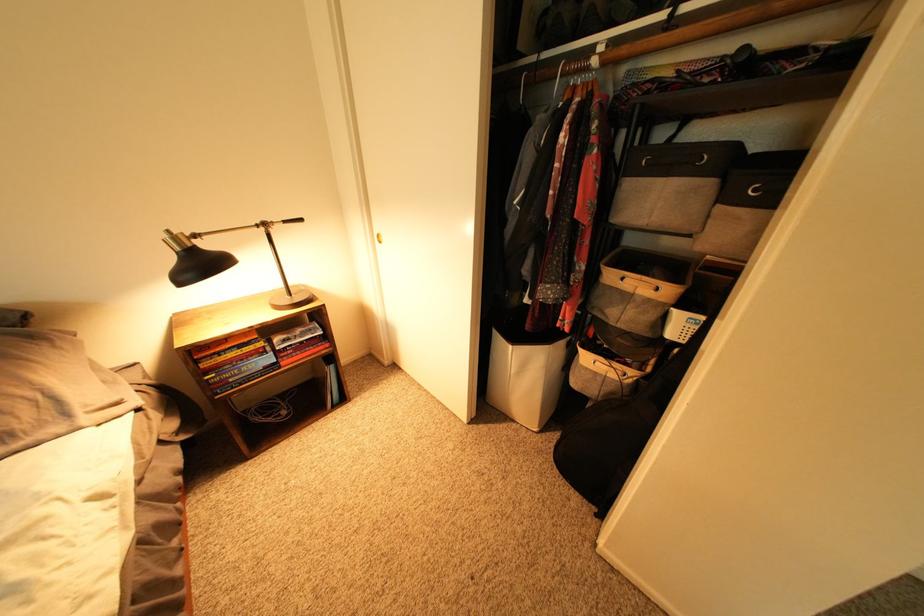
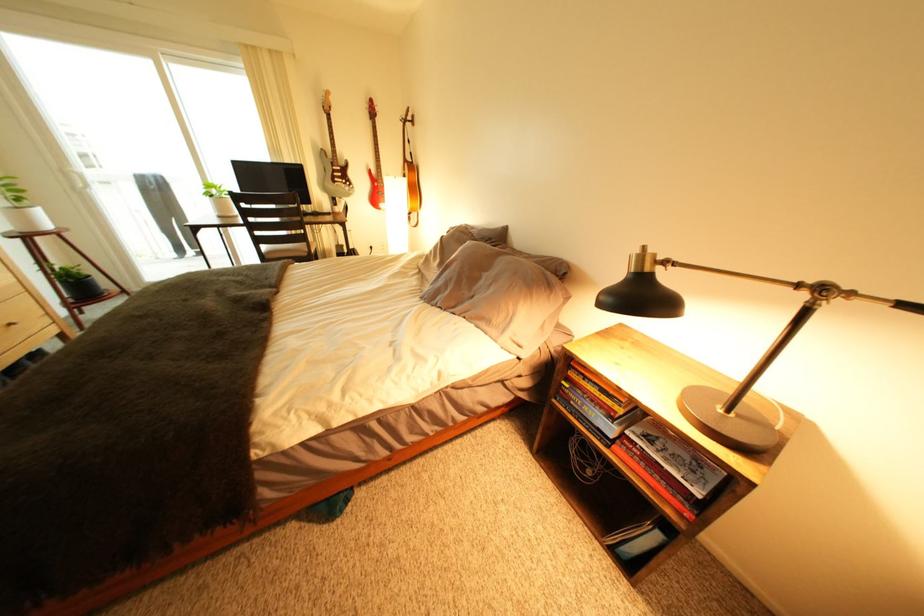
First-person continuous shooting, in which direction is the camera rotating?

The rotation direction of the camera is left-down.